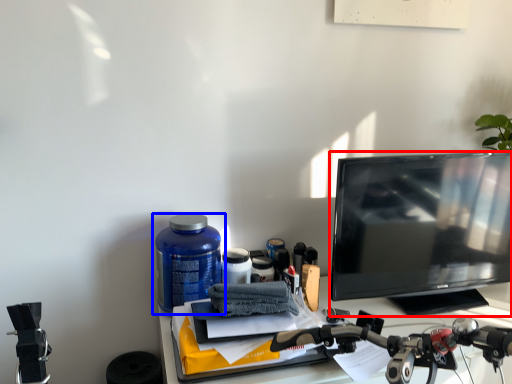
Question: Which object appears farthest to the camera in this image, television (highlighted by a red box) or bottle (highlighted by a blue box)?

Choices:
 (A) television
 (B) bottle

Answer: (B)